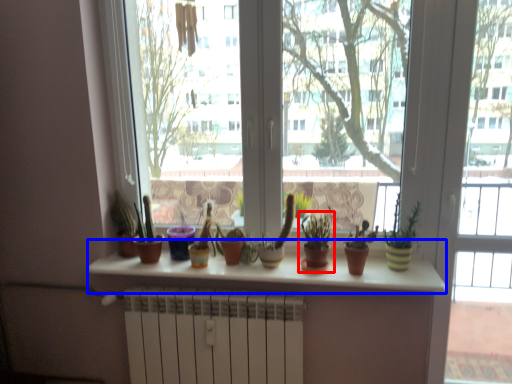
Question: Which of the following is the closest to the observer, houseplant (highlighted by a red box) or counter top (highlighted by a blue box)?

Choices:
 (A) houseplant
 (B) counter top

Answer: (B)